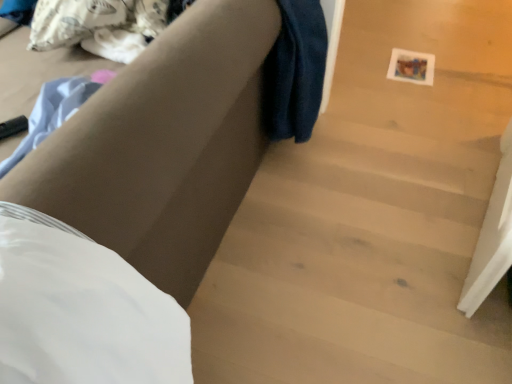
Find the location of a particular element. free space above wooden stairs at center (from a real-world perspective) is located at coordinates (355, 277).